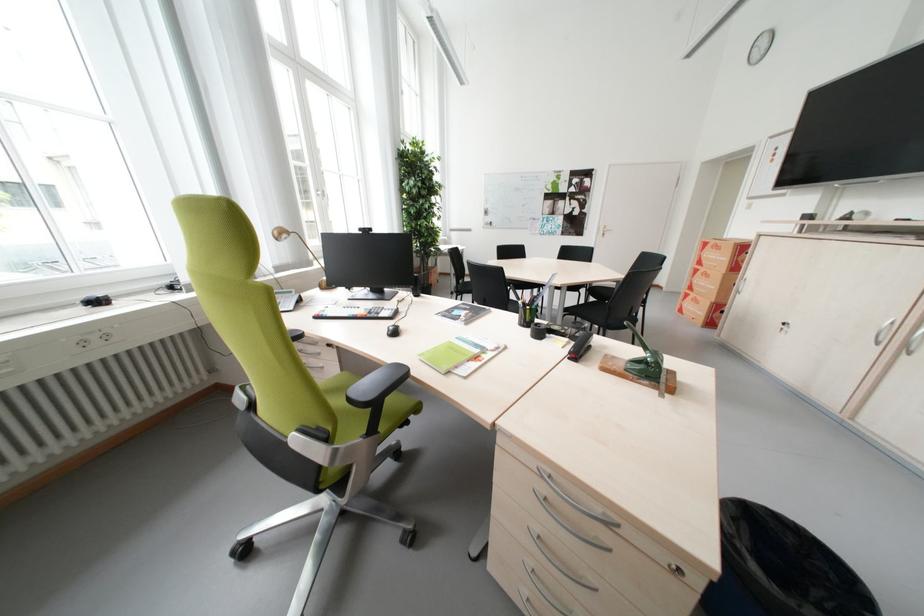
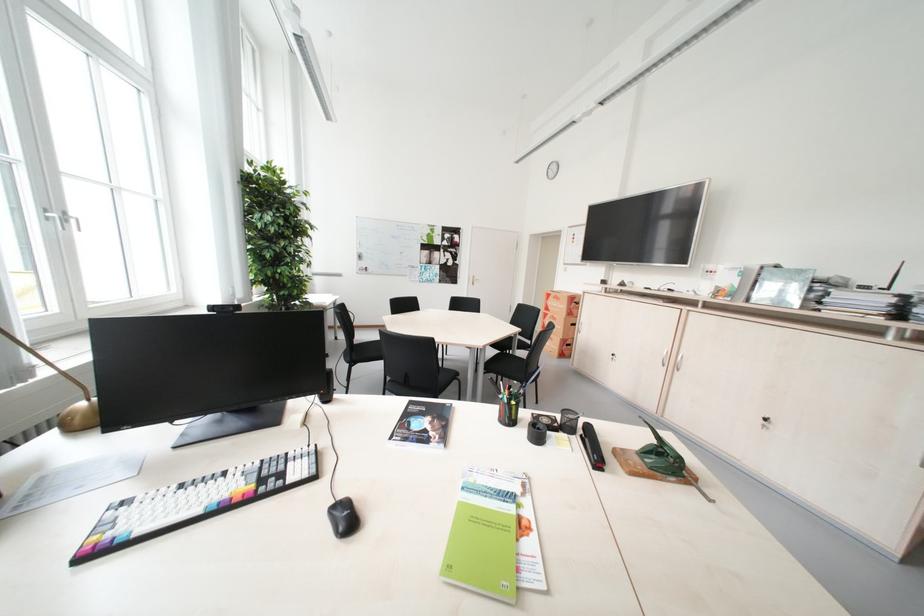
Find the pixel in the second image that matches point (405, 334) in the first image.

(359, 521)